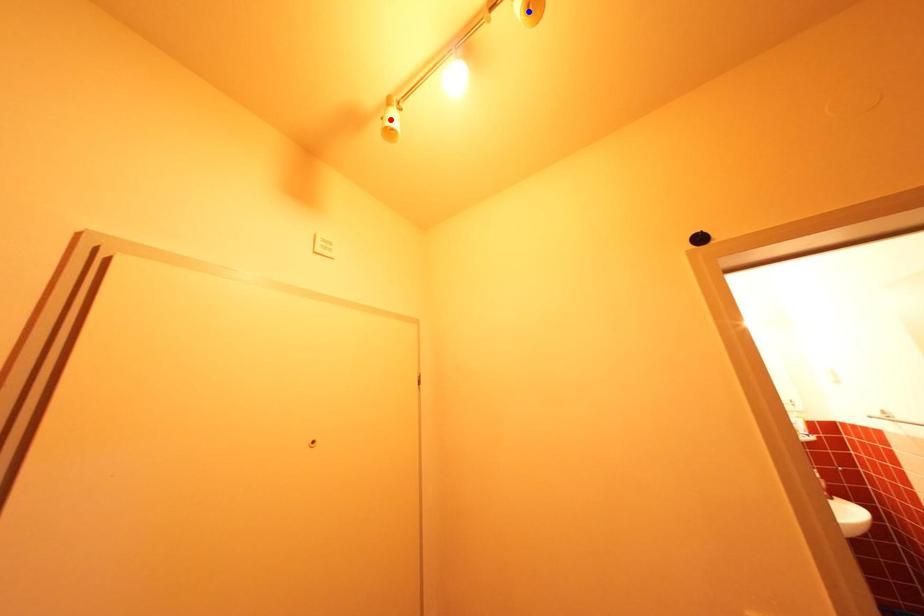
Question: In the image, two points are highlighted. Which point is nearer to the camera? Reply with the corresponding letter.

Choices:
 (A) blue point
 (B) red point

Answer: (A)